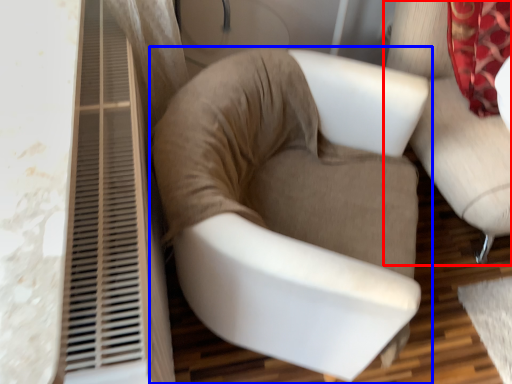
Question: Which point is closer to the camera, chair (highlighted by a red box) or chair (highlighted by a blue box)?

Choices:
 (A) chair
 (B) chair

Answer: (B)